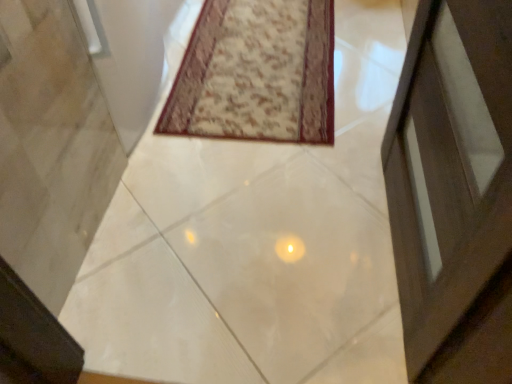
The height and width of the screenshot is (384, 512). I want to click on vacant space in front of beige textured rug at center, so click(x=249, y=208).